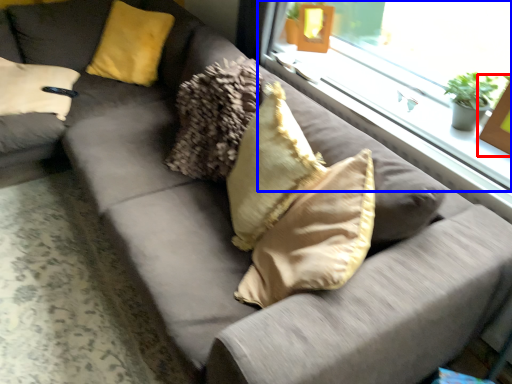
Question: Which point is closer to the camera, picture frame (highlighted by a red box) or window (highlighted by a blue box)?

Choices:
 (A) picture frame
 (B) window

Answer: (A)